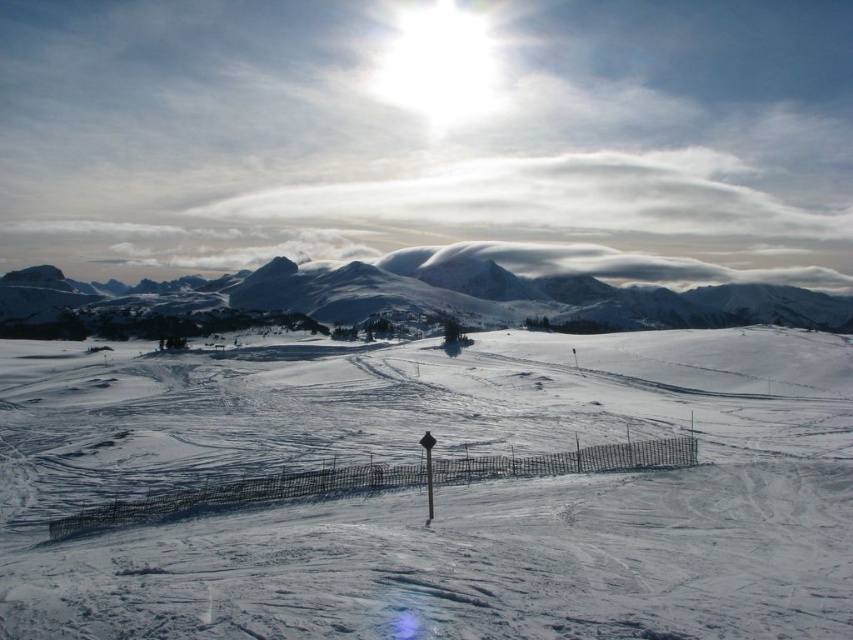
You are standing at the center of the image and want to walk towards the white powdery snow at center. Which direction should you go?

The white powdery snow at center is located at point coordinates of (442, 492). Since you are at the center, you should move towards the direction of the coordinates to reach it.

You are a skier planning to take a photo of the snowy mountain at upper center while standing on the white powdery snow at center. Since you want the mountain to be the main focus, should you move to your left or right to position it better in the frame?

The white powdery snow at center is to the left of snowy mountain at upper center. To have the mountain as the main focus, you should move to your right to position it better in the frame.